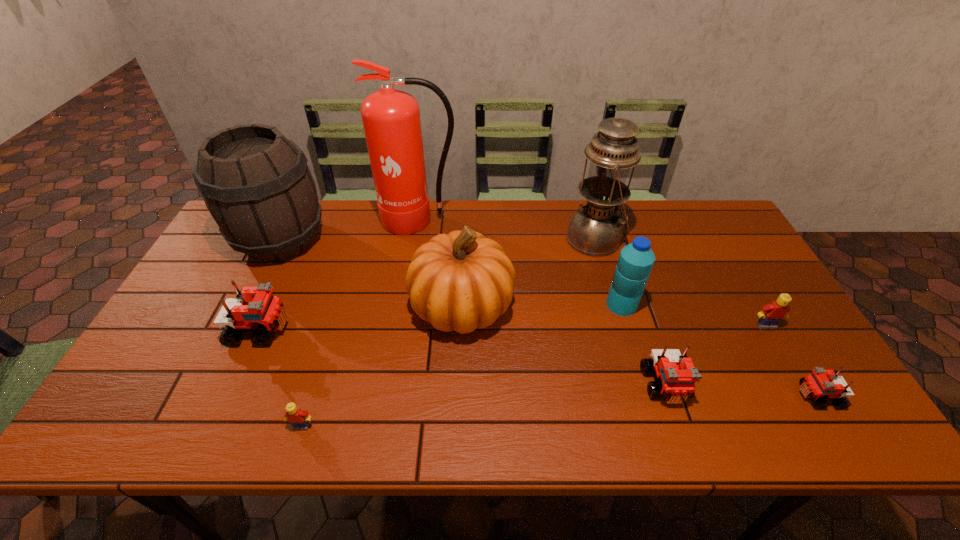
The width and height of the screenshot is (960, 540). In order to click on object that is at the far left corner in this screenshot , I will do `click(256, 184)`.

The width and height of the screenshot is (960, 540). What are the coordinates of `object located at the near right corner` in the screenshot? It's located at (822, 384).

The image size is (960, 540). I want to click on free space at the far edge of the desktop, so click(x=338, y=209).

Find the location of a particular element. free space at the near edge of the desktop is located at coordinates (658, 415).

In order to click on vacant area at the left edge of the desktop in this screenshot , I will do `click(196, 314)`.

This screenshot has height=540, width=960. Find the location of `vacant position at the right edge of the desktop`. vacant position at the right edge of the desktop is located at coordinates (796, 338).

I want to click on vacant region between the orange pumpkin and the farthest red Lego, so click(361, 318).

Locate an element on the screen. This screenshot has width=960, height=540. vacant point located between the oil lamp and the rightmost red Lego is located at coordinates (707, 318).

Where is `vacant space in between the second red Lego from left to right and the left yellow Lego`? vacant space in between the second red Lego from left to right and the left yellow Lego is located at coordinates (484, 406).

I want to click on vacant area that lies between the left yellow Lego and the pumpkin, so click(382, 366).